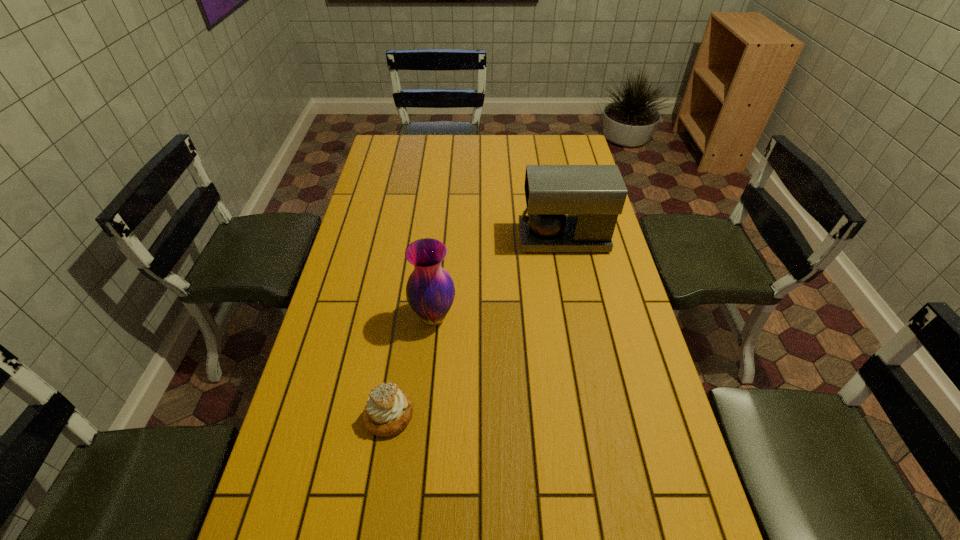
Identify the location of vacant area between the vase and the farthest object. 498,278.

I want to click on the second closest object to the second farthest object, so click(x=570, y=208).

Select which object appears as the closest to the shortest object. Please provide its 2D coordinates. Your answer should be formatted as a tuple, i.e. [(x, y)], where the tuple contains the x and y coordinates of a point satisfying the conditions above.

[(430, 291)]

The image size is (960, 540). I want to click on vacant space that satisfies the following two spatial constraints: 1. on the carafe side of the rightmost object; 2. on the front side of the vase, so click(x=579, y=316).